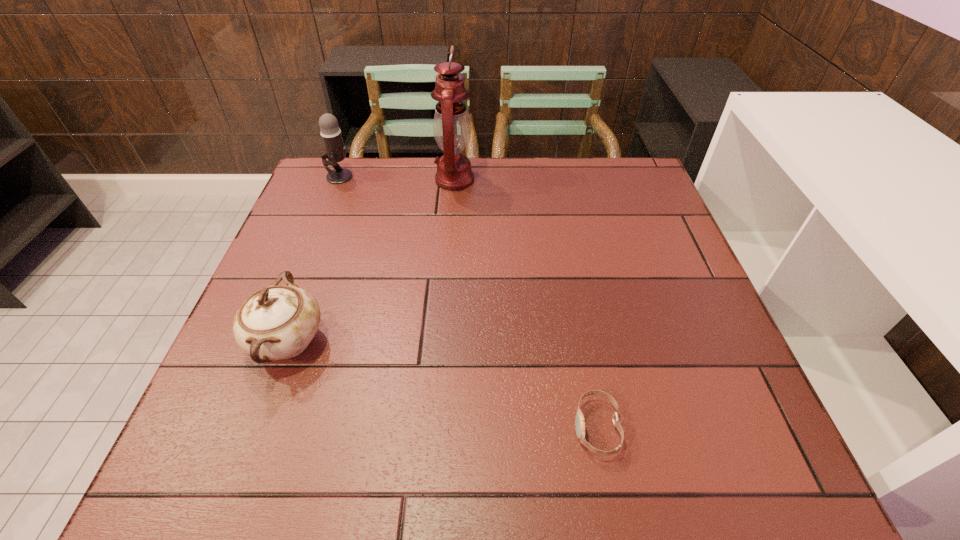
Locate an element on the screen. free point located 0.100m on the face of the shortest object is located at coordinates (517, 427).

This screenshot has height=540, width=960. In order to click on free space located 0.400m on the face of the shortest object in this screenshot , I will do `click(346, 427)`.

Where is `free space located on the face of the shortest object`? The image size is (960, 540). free space located on the face of the shortest object is located at coordinates (478, 427).

Where is `oil lamp present at the far edge`? The height and width of the screenshot is (540, 960). oil lamp present at the far edge is located at coordinates (452, 129).

Locate an element on the screen. microphone present at the far edge is located at coordinates (331, 135).

The height and width of the screenshot is (540, 960). In order to click on object that is at the near edge in this screenshot , I will do `click(579, 419)`.

You are a GUI agent. You are given a task and a screenshot of the screen. Output one action in this format:
    pyautogui.click(x=<x>, y=<y>)
    Task: Click on the microphone located in the left edge section of the desktop
    The image size is (960, 540).
    Given the screenshot: What is the action you would take?
    pyautogui.click(x=331, y=135)

Locate an element on the screen. The image size is (960, 540). chinaware that is positioned at the left edge is located at coordinates (278, 322).

Where is `object present at the far left corner`? The width and height of the screenshot is (960, 540). object present at the far left corner is located at coordinates (331, 135).

This screenshot has width=960, height=540. In the image, there is a desktop. In order to click on vacant space at the far edge in this screenshot , I will do `click(412, 193)`.